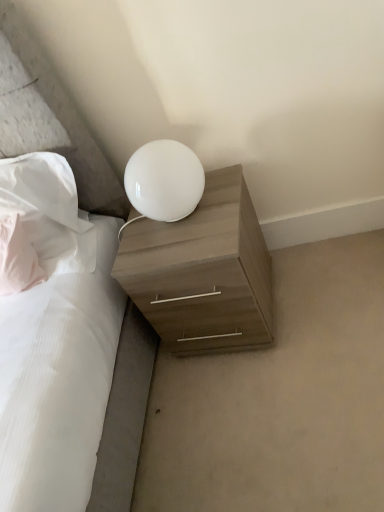
What do you see at coordinates (49, 211) in the screenshot?
I see `white fabric pillow at upper left, arranged as the 1th pillow when viewed from the right` at bounding box center [49, 211].

What are the coordinates of `white glossy lamp at upper center` in the screenshot? It's located at (164, 180).

Locate an element on the screen. The width and height of the screenshot is (384, 512). light wood/texture nightstand at lower right is located at coordinates (203, 272).

Does pink fabric pillow at left, which is counted as the first pillow, starting from the left, lie in front of light wood/texture nightstand at lower right?

No, the depth of pink fabric pillow at left, which is counted as the first pillow, starting from the left, is greater than that of light wood/texture nightstand at lower right.

Is point (13, 280) less distant than point (163, 253)?

No, (13, 280) is behind (163, 253).

Can you tell me how much pink fabric pillow at left, which is counted as the first pillow, starting from the left, and light wood/texture nightstand at lower right differ in facing direction?

1.49 degrees.

Identify the location of the 2nd pillow counting from the left of the light wood/texture nightstand at lower right. The height and width of the screenshot is (512, 384). (17, 258).

Considering the sizes of objects white fabric pillow at upper left, which appears as the 2th pillow when viewed from the left, and light wood/texture nightstand at lower right in the image provided, who is shorter, white fabric pillow at upper left, which appears as the 2th pillow when viewed from the left, or light wood/texture nightstand at lower right?

Standing shorter between the two is white fabric pillow at upper left, which appears as the 2th pillow when viewed from the left.

From the image's perspective, which pillow is the 2nd one above the light wood/texture nightstand at lower right? Please provide its 2D coordinates.

[(49, 211)]

Do you think white fabric pillow at upper left, which appears as the 2th pillow when viewed from the left, is within light wood/texture nightstand at lower right, or outside of it?

white fabric pillow at upper left, which appears as the 2th pillow when viewed from the left, cannot be found inside light wood/texture nightstand at lower right.

Which object is closer to the camera taking this photo, white fabric pillow at upper left, which appears as the 2th pillow when viewed from the left, or white glossy lamp at upper center?

white glossy lamp at upper center is more forward.

Locate an element on the screen. Image resolution: width=384 pixels, height=512 pixels. lamp in front of the white fabric pillow at upper left, arranged as the 1th pillow when viewed from the right is located at coordinates pyautogui.click(x=164, y=180).

Which is closer to the camera, (83, 265) or (159, 179)?

The point (159, 179) is more forward.

From a real-world perspective, is white fabric pillow at upper left, which appears as the 2th pillow when viewed from the left, physically above white glossy lamp at upper center?

Yes.

Is light wood/texture nightstand at lower right located outside white fabric pillow at upper left, arranged as the 1th pillow when viewed from the right?

Yes, light wood/texture nightstand at lower right is not within white fabric pillow at upper left, arranged as the 1th pillow when viewed from the right.

Does point (219, 177) appear closer or farther from the camera than point (5, 175)?

Point (219, 177) is positioned farther from the camera compared to point (5, 175).

Identify the location of nightstand in front of the white fabric pillow at upper left, arranged as the 1th pillow when viewed from the right. The height and width of the screenshot is (512, 384). (203, 272).

From the image's perspective, which is below, light wood/texture nightstand at lower right or white fabric pillow at upper left, which appears as the 2th pillow when viewed from the left?

light wood/texture nightstand at lower right, from the image's perspective.

Considering the sizes of objects white glossy lamp at upper center and light wood/texture nightstand at lower right in the image provided, who is thinner, white glossy lamp at upper center or light wood/texture nightstand at lower right?

white glossy lamp at upper center is thinner.

Which is behind, white glossy lamp at upper center or light wood/texture nightstand at lower right?

light wood/texture nightstand at lower right is further from the camera.

Would you say white glossy lamp at upper center is a long distance from light wood/texture nightstand at lower right?

Actually, white glossy lamp at upper center and light wood/texture nightstand at lower right are a little close together.

Does pink fabric pillow at left, acting as the second pillow starting from the right, have a lesser width compared to white fabric pillow at upper left, arranged as the 1th pillow when viewed from the right?

Correct, the width of pink fabric pillow at left, acting as the second pillow starting from the right, is less than that of white fabric pillow at upper left, arranged as the 1th pillow when viewed from the right.

Does pink fabric pillow at left, acting as the second pillow starting from the right, appear on the left side of white fabric pillow at upper left, arranged as the 1th pillow when viewed from the right?

Yes.

Is pink fabric pillow at left, which is counted as the first pillow, starting from the left, looking in the opposite direction of white fabric pillow at upper left, which appears as the 2th pillow when viewed from the left?

Yes.

Is white fabric pillow at upper left, arranged as the 1th pillow when viewed from the right, inside pink fabric pillow at left, acting as the second pillow starting from the right?

No, white fabric pillow at upper left, arranged as the 1th pillow when viewed from the right, is not inside pink fabric pillow at left, acting as the second pillow starting from the right.

From the picture: Can you confirm if light wood/texture nightstand at lower right is bigger than white glossy lamp at upper center?

Indeed, light wood/texture nightstand at lower right has a larger size compared to white glossy lamp at upper center.

From a real-world perspective, does light wood/texture nightstand at lower right stand above white glossy lamp at upper center?

Incorrect, from a real-world perspective, light wood/texture nightstand at lower right is lower than white glossy lamp at upper center.

Does light wood/texture nightstand at lower right touch white glossy lamp at upper center?

No, light wood/texture nightstand at lower right is not making contact with white glossy lamp at upper center.

Is white glossy lamp at upper center completely or partially inside light wood/texture nightstand at lower right?

No.

In order to click on pillow that is the 2nd object to the left of the light wood/texture nightstand at lower right, starting at the anchor in this screenshot , I will do `click(17, 258)`.

Find the location of a particular element. This screenshot has height=512, width=384. nightstand on the right of the white fabric pillow at upper left, arranged as the 1th pillow when viewed from the right is located at coordinates (203, 272).

Estimate the real-world distances between objects in this image. Which object is closer to white glossy lamp at upper center, light wood/texture nightstand at lower right or white fabric pillow at upper left, arranged as the 1th pillow when viewed from the right?

light wood/texture nightstand at lower right is closer to white glossy lamp at upper center.

Considering their positions, is light wood/texture nightstand at lower right positioned further to white fabric pillow at upper left, arranged as the 1th pillow when viewed from the right, than pink fabric pillow at left, which is counted as the first pillow, starting from the left?

light wood/texture nightstand at lower right.

Based on their spatial positions, is pink fabric pillow at left, acting as the second pillow starting from the right, or white fabric pillow at upper left, arranged as the 1th pillow when viewed from the right, further from white glossy lamp at upper center?

pink fabric pillow at left, acting as the second pillow starting from the right, is further to white glossy lamp at upper center.

From the image, which object appears to be nearer to pink fabric pillow at left, acting as the second pillow starting from the right, light wood/texture nightstand at lower right or white fabric pillow at upper left, which appears as the 2th pillow when viewed from the left?

Based on the image, white fabric pillow at upper left, which appears as the 2th pillow when viewed from the left, appears to be nearer to pink fabric pillow at left, acting as the second pillow starting from the right.

Based on their spatial positions, is white glossy lamp at upper center or white fabric pillow at upper left, arranged as the 1th pillow when viewed from the right, further from pink fabric pillow at left, acting as the second pillow starting from the right?

white glossy lamp at upper center lies further to pink fabric pillow at left, acting as the second pillow starting from the right, than the other object.

Estimate the real-world distances between objects in this image. Which object is closer to pink fabric pillow at left, which is counted as the first pillow, starting from the left, light wood/texture nightstand at lower right or white glossy lamp at upper center?

Among the two, white glossy lamp at upper center is located nearer to pink fabric pillow at left, which is counted as the first pillow, starting from the left.

When comparing their distances from white fabric pillow at upper left, which appears as the 2th pillow when viewed from the left, does pink fabric pillow at left, which is counted as the first pillow, starting from the left, or light wood/texture nightstand at lower right seem further?

Among the two, light wood/texture nightstand at lower right is located further to white fabric pillow at upper left, which appears as the 2th pillow when viewed from the left.

Based on their spatial positions, is pink fabric pillow at left, which is counted as the first pillow, starting from the left, or white glossy lamp at upper center closer to light wood/texture nightstand at lower right?

white glossy lamp at upper center.

Image resolution: width=384 pixels, height=512 pixels. I want to click on pillow between pink fabric pillow at left, acting as the second pillow starting from the right, and white glossy lamp at upper center from left to right, so click(x=49, y=211).

Where is `lamp situated between white fabric pillow at upper left, which appears as the 2th pillow when viewed from the left, and light wood/texture nightstand at lower right from left to right`? lamp situated between white fabric pillow at upper left, which appears as the 2th pillow when viewed from the left, and light wood/texture nightstand at lower right from left to right is located at coordinates (164, 180).

Find the location of a particular element. This screenshot has width=384, height=512. lamp situated between pink fabric pillow at left, acting as the second pillow starting from the right, and light wood/texture nightstand at lower right from left to right is located at coordinates (164, 180).

Where is `pillow between pink fabric pillow at left, which is counted as the first pillow, starting from the left, and light wood/texture nightstand at lower right, in the horizontal direction`? pillow between pink fabric pillow at left, which is counted as the first pillow, starting from the left, and light wood/texture nightstand at lower right, in the horizontal direction is located at coordinates (49, 211).